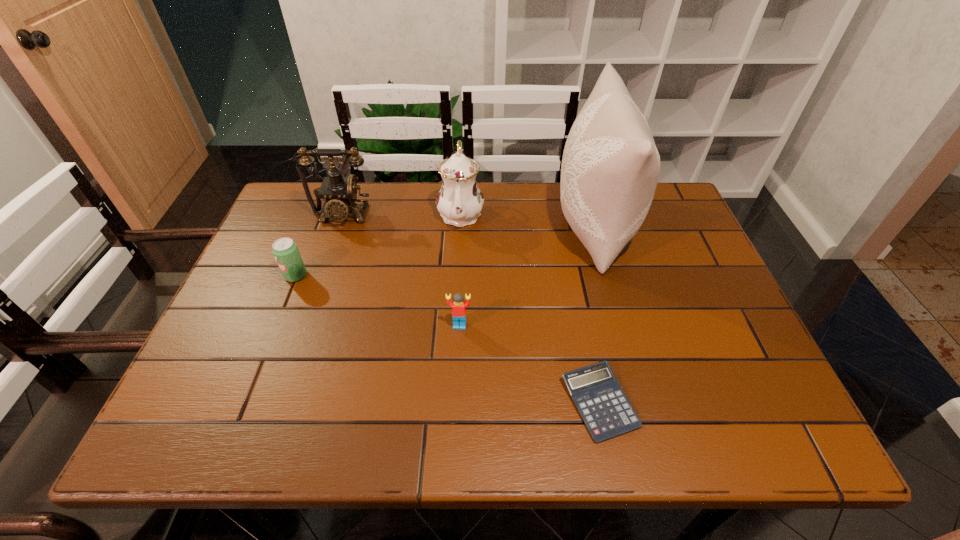
Identify the location of object that is the fourth closest one to the shortest object. The image size is (960, 540). (285, 250).

Identify the location of object that stands as the fourth closest to the calculator. (285, 250).

Where is `free spot that satisfies the following two spatial constraints: 1. on the back side of the soda; 2. on the left side of the chinaware`? The width and height of the screenshot is (960, 540). free spot that satisfies the following two spatial constraints: 1. on the back side of the soda; 2. on the left side of the chinaware is located at coordinates (321, 213).

At what (x,y) coordinates should I click in order to perform the action: click on free space that satisfies the following two spatial constraints: 1. on the front side of the tallest object; 2. on the face of the Lego. Please return your answer as a coordinate pair (x, y). This screenshot has width=960, height=540. Looking at the image, I should click on (621, 325).

This screenshot has height=540, width=960. In order to click on vacant space that satisfies the following two spatial constraints: 1. on the front side of the cushion; 2. on the front side of the soda in this screenshot , I will do `click(608, 275)`.

Locate an element on the screen. The height and width of the screenshot is (540, 960). vacant point that satisfies the following two spatial constraints: 1. on the face of the shortest object; 2. on the right side of the Lego is located at coordinates (457, 403).

You are a GUI agent. You are given a task and a screenshot of the screen. Output one action in this format:
    pyautogui.click(x=<x>, y=<y>)
    Task: Click on the vacant space that satisfies the following two spatial constraints: 1. on the front side of the chinaware; 2. on the left side of the nearest object
    
    Given the screenshot: What is the action you would take?
    pyautogui.click(x=451, y=403)

Locate an element on the screen. The width and height of the screenshot is (960, 540). vacant space that satisfies the following two spatial constraints: 1. on the front side of the cushion; 2. on the front side of the shortest object is located at coordinates (643, 403).